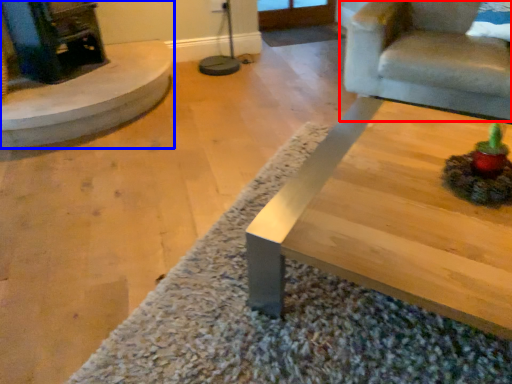
Question: Which of the following is the farthest to the observer, chair (highlighted by a red box) or fireplace (highlighted by a blue box)?

Choices:
 (A) chair
 (B) fireplace

Answer: (B)